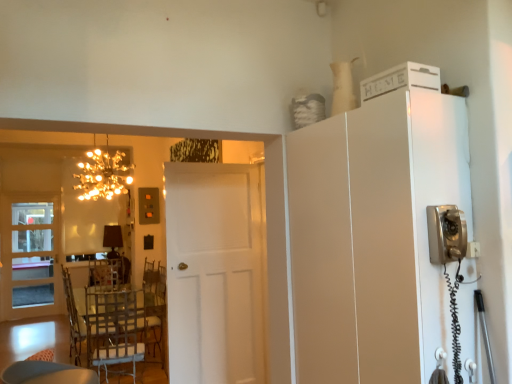
Question: From the image's perspective, is white matte door at center, placed as the second door when sorted from back to front, beneath white matte cabinet at upper right, arranged as the 2th appliance when viewed from the front?

Choices:
 (A) yes
 (B) no

Answer: (A)

Question: Can you confirm if white matte door at center, which ranks as the first door in front-to-back order, is wider than white matte cabinet at upper right, arranged as the 2th appliance when viewed from the front?

Choices:
 (A) no
 (B) yes

Answer: (A)

Question: From the image's perspective, does white matte door at center, which ranks as the first door in front-to-back order, appear higher than white matte cabinet at upper right, which is the 1th appliance in back-to-front order?

Choices:
 (A) yes
 (B) no

Answer: (B)

Question: Considering the relative sizes of white matte door at center, placed as the second door when sorted from back to front, and white matte cabinet at upper right, arranged as the 2th appliance when viewed from the front, in the image provided, is white matte door at center, placed as the second door when sorted from back to front, bigger than white matte cabinet at upper right, arranged as the 2th appliance when viewed from the front,?

Choices:
 (A) yes
 (B) no

Answer: (A)

Question: Can we say white matte door at center, placed as the second door when sorted from back to front, lies outside white matte cabinet at upper right, which is the 1th appliance in back-to-front order?

Choices:
 (A) yes
 (B) no

Answer: (A)

Question: Is satin silver telephone at right, which is counted as the 1th appliance, starting from the front, taller or shorter than white matte cabinet at upper right?

Choices:
 (A) tall
 (B) short

Answer: (B)

Question: Is satin silver telephone at right, which is the first appliance from bottom to top, bigger or smaller than white matte cabinet at upper right?

Choices:
 (A) small
 (B) big

Answer: (A)

Question: Considering the relative positions of satin silver telephone at right, which is the second appliance from back to front, and white matte cabinet at upper right in the image provided, is satin silver telephone at right, which is the second appliance from back to front, to the left or to the right of white matte cabinet at upper right?

Choices:
 (A) left
 (B) right

Answer: (B)

Question: Is point (458, 218) positioned closer to the camera than point (411, 271)?

Choices:
 (A) farther
 (B) closer

Answer: (A)

Question: Looking at the image, does white matte door at center, which ranks as the first door in front-to-back order, seem bigger or smaller compared to white matte cabinet at upper right?

Choices:
 (A) small
 (B) big

Answer: (A)

Question: In terms of height, does white matte door at center, placed as the second door when sorted from back to front, look taller or shorter compared to white matte cabinet at upper right?

Choices:
 (A) short
 (B) tall

Answer: (B)

Question: In the image, is white matte door at center, positioned as the 2th door in left-to-right order, positioned in front of or behind white matte cabinet at upper right?

Choices:
 (A) front
 (B) behind

Answer: (B)

Question: Is point (215, 201) positioned closer to the camera than point (402, 205)?

Choices:
 (A) closer
 (B) farther

Answer: (B)

Question: Based on their sizes in the image, would you say satin silver telephone at right, which is counted as the 1th appliance, starting from the front, is bigger or smaller than gold metallic chandelier at upper left?

Choices:
 (A) small
 (B) big

Answer: (A)

Question: Relative to gold metallic chandelier at upper left, is satin silver telephone at right, which is the second appliance from back to front, in front or behind?

Choices:
 (A) front
 (B) behind

Answer: (A)